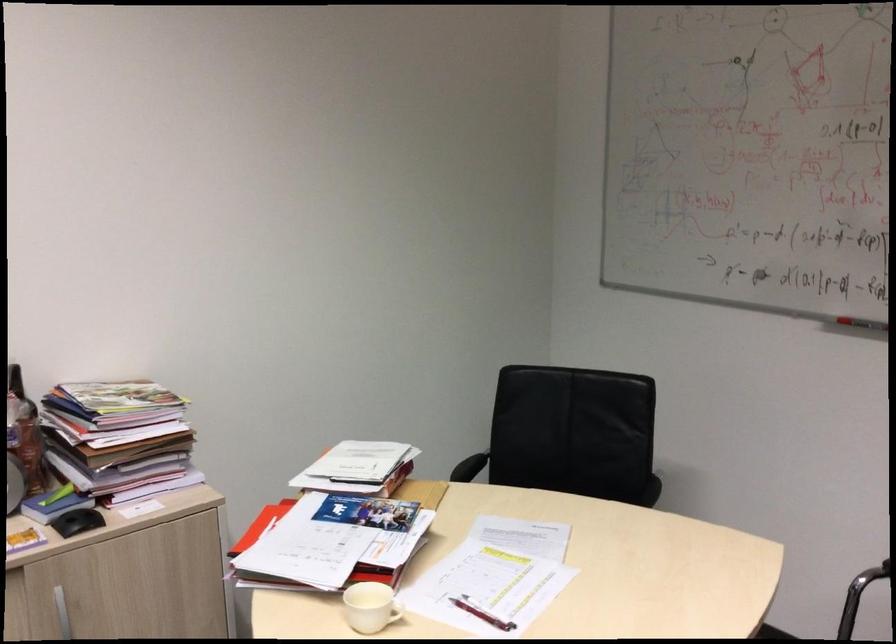
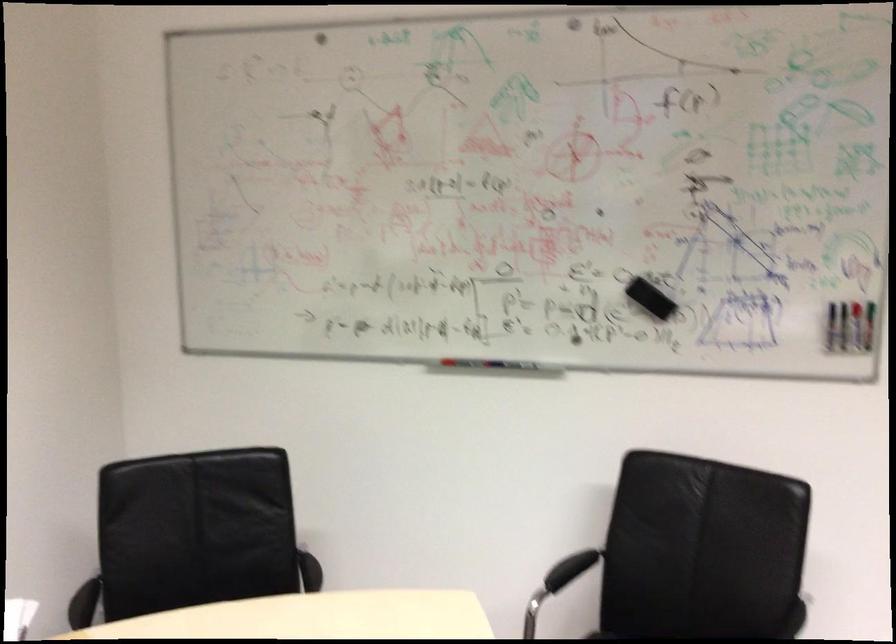
Question: Based on the continuous images, in which direction is the camera rotating? Reply with the corresponding letter.

Choices:
 (A) Left
 (B) Right
 (C) Up
 (D) Down

Answer: (B)